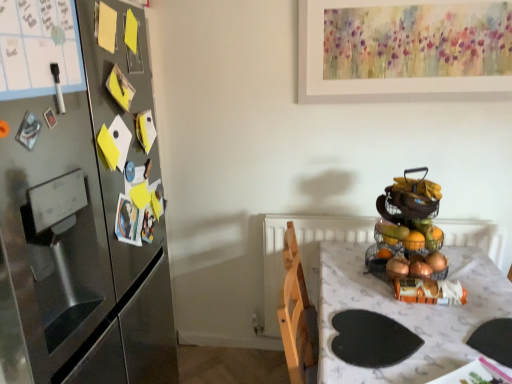
Question: Can you confirm if stainless steel refrigerator at left is positioned to the left of white glossy table at center?

Choices:
 (A) yes
 (B) no

Answer: (A)

Question: Is stainless steel refrigerator at left positioned with its back to white glossy table at center?

Choices:
 (A) no
 (B) yes

Answer: (A)

Question: Is the position of stainless steel refrigerator at left more distant than that of white glossy table at center?

Choices:
 (A) yes
 (B) no

Answer: (B)

Question: Does stainless steel refrigerator at left come in front of white glossy table at center?

Choices:
 (A) yes
 (B) no

Answer: (A)

Question: Is stainless steel refrigerator at left not within white glossy table at center?

Choices:
 (A) yes
 (B) no

Answer: (A)

Question: Considering the relative positions of white glossy table at center and wire mesh fruit basket at right, acting as the first basket starting from the top, in the image provided, is white glossy table at center to the left or to the right of wire mesh fruit basket at right, acting as the first basket starting from the top,?

Choices:
 (A) right
 (B) left

Answer: (B)

Question: In terms of size, does white glossy table at center appear bigger or smaller than wire mesh fruit basket at right, acting as the first basket starting from the top?

Choices:
 (A) big
 (B) small

Answer: (A)

Question: From a real-world perspective, relative to wire mesh fruit basket at right, the second basket from the bottom, is white glossy table at center vertically above or below?

Choices:
 (A) above
 (B) below

Answer: (B)

Question: From the image's perspective, is white glossy table at center located above or below wire mesh fruit basket at right, the second basket from the bottom?

Choices:
 (A) below
 (B) above

Answer: (A)

Question: Would you say stainless steel refrigerator at left is to the left or to the right of wire mesh fruit basket at right, acting as the first basket starting from the top, in the picture?

Choices:
 (A) left
 (B) right

Answer: (A)

Question: Considering the positions of point (74, 86) and point (374, 228), is point (74, 86) closer or farther from the camera than point (374, 228)?

Choices:
 (A) farther
 (B) closer

Answer: (B)

Question: In terms of width, does stainless steel refrigerator at left look wider or thinner when compared to wire mesh fruit basket at right, the second basket from the bottom?

Choices:
 (A) wide
 (B) thin

Answer: (A)

Question: In terms of height, does stainless steel refrigerator at left look taller or shorter compared to wire mesh fruit basket at right, acting as the first basket starting from the top?

Choices:
 (A) tall
 (B) short

Answer: (A)

Question: In terms of height, does wire mesh fruit basket at right, acting as the first basket starting from the top, look taller or shorter compared to stainless steel refrigerator at left?

Choices:
 (A) short
 (B) tall

Answer: (A)

Question: Looking at their shapes, would you say wire mesh fruit basket at right, the second basket from the bottom, is wider or thinner than stainless steel refrigerator at left?

Choices:
 (A) wide
 (B) thin

Answer: (B)